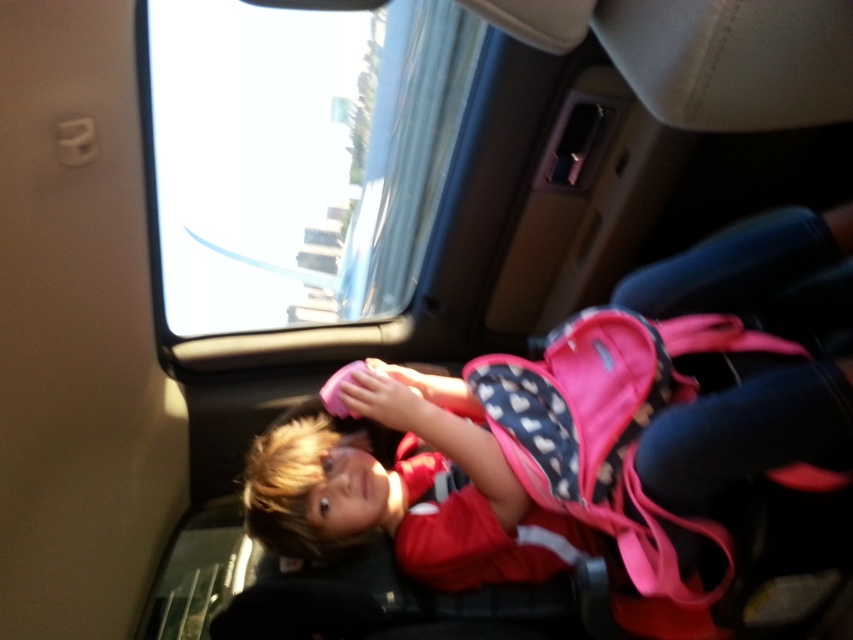
Question: Which object appears closest to the camera in this image?

Choices:
 (A) pink fabric backpack at center
 (B) transparent glass window at upper center

Answer: (A)

Question: Can you confirm if transparent glass window at upper center is positioned below pink fabric backpack at center?

Choices:
 (A) no
 (B) yes

Answer: (A)

Question: In this image, where is transparent glass window at upper center located relative to pink fabric backpack at center?

Choices:
 (A) right
 (B) left

Answer: (B)

Question: Which object is closer to the camera taking this photo?

Choices:
 (A) pink fabric backpack at center
 (B) transparent glass window at upper center

Answer: (A)

Question: Is transparent glass window at upper center above pink fabric backpack at center?

Choices:
 (A) yes
 (B) no

Answer: (A)